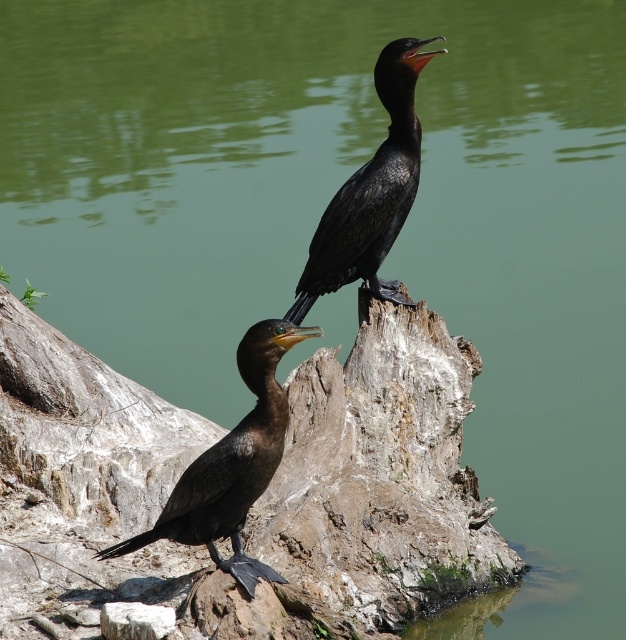
Question: Which object appears closest to the camera in this image?

Choices:
 (A) shiny black bird at lower left
 (B) shiny black bird at center

Answer: (A)

Question: Considering the relative positions of shiny black bird at lower left and shiny black bird at center in the image provided, where is shiny black bird at lower left located with respect to shiny black bird at center?

Choices:
 (A) above
 (B) below

Answer: (B)

Question: Is shiny black bird at lower left to the right of shiny black bird at center from the viewer's perspective?

Choices:
 (A) yes
 (B) no

Answer: (B)

Question: Which point is farther to the camera?

Choices:
 (A) shiny black bird at center
 (B) shiny black bird at lower left

Answer: (A)

Question: Where is shiny black bird at lower left located in relation to shiny black bird at center in the image?

Choices:
 (A) above
 (B) below

Answer: (B)